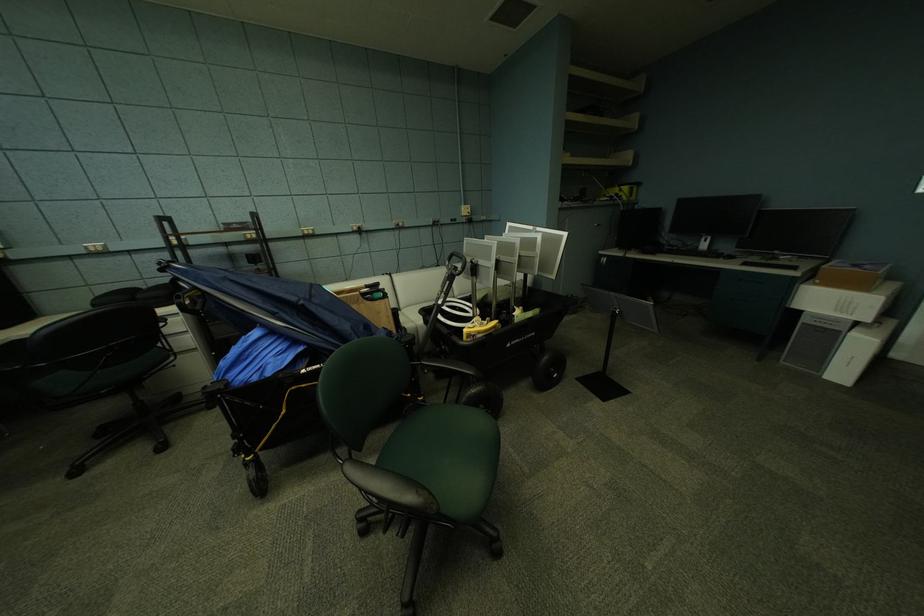
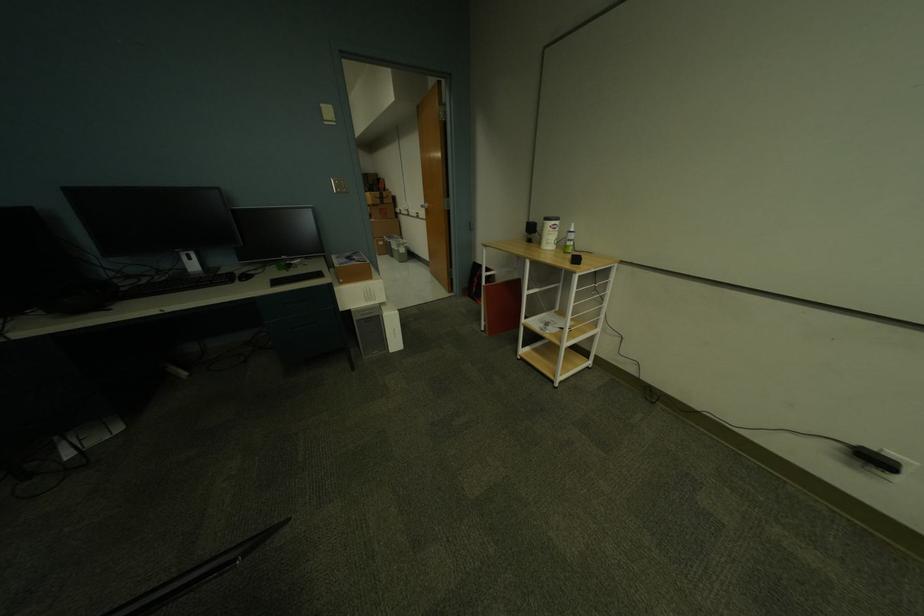
The point at (x=825, y=284) is marked in the first image. Where is the corresponding point in the second image?

(349, 282)